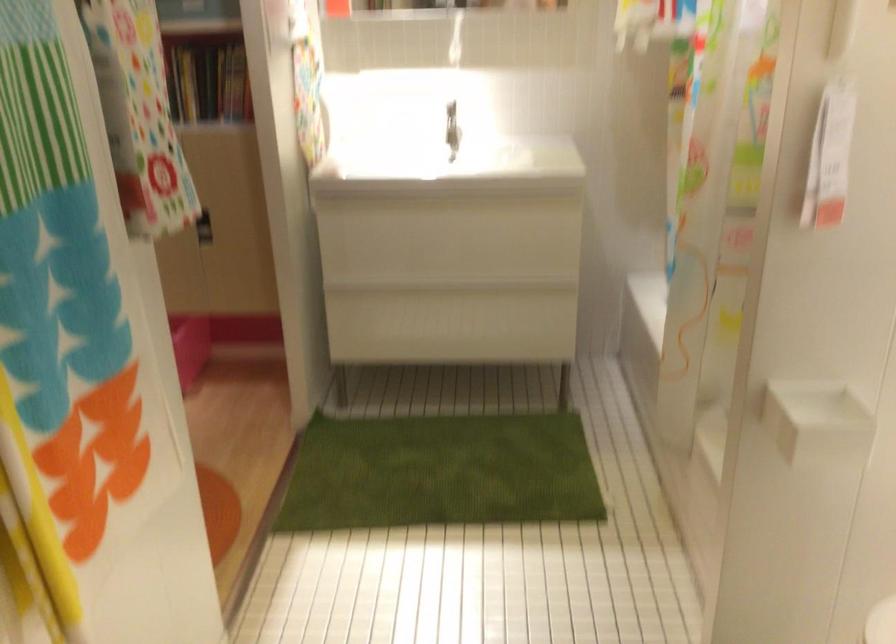
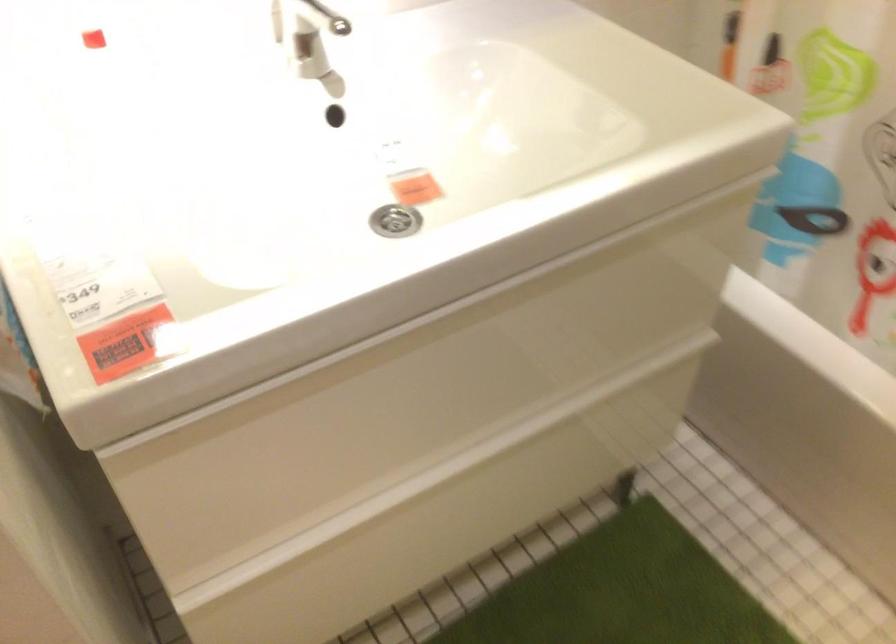
In the second image, find the point that corresponds to the point at 423,236 in the first image.

(423, 392)